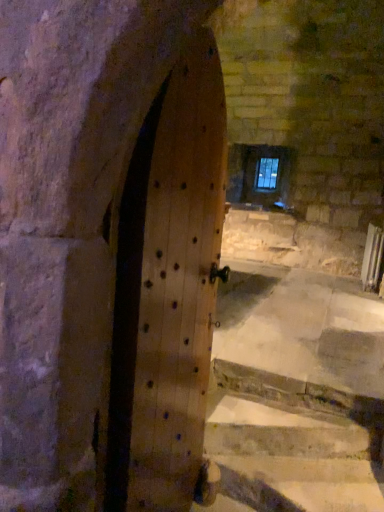
Locate an element on the screen. The height and width of the screenshot is (512, 384). clear glass window at upper center is located at coordinates (267, 173).

The height and width of the screenshot is (512, 384). Describe the element at coordinates (267, 173) in the screenshot. I see `clear glass window at upper center` at that location.

The height and width of the screenshot is (512, 384). Find the location of `natural wood door at center`. natural wood door at center is located at coordinates (167, 289).

The image size is (384, 512). What do you see at coordinates (167, 289) in the screenshot?
I see `natural wood door at center` at bounding box center [167, 289].

Locate an element on the screen. clear glass window at upper center is located at coordinates (267, 173).

Is natural wood door at center to the left of clear glass window at upper center from the viewer's perspective?

Yes, natural wood door at center is to the left of clear glass window at upper center.

In the image, is natural wood door at center positioned in front of or behind clear glass window at upper center?

natural wood door at center is positioned closer to the viewer than clear glass window at upper center.

Considering the positions of points (162, 388) and (271, 182), is point (162, 388) farther from camera compared to point (271, 182)?

That is False.

From the image's perspective, which is below, natural wood door at center or clear glass window at upper center?

natural wood door at center appears lower in the image.

From a real-world perspective, which object stands above the other?

From a 3D spatial view, clear glass window at upper center is above.

Which of these two, natural wood door at center or clear glass window at upper center, is wider?

Wider between the two is natural wood door at center.

Can you confirm if natural wood door at center is taller than clear glass window at upper center?

Yes.

Which of these two, natural wood door at center or clear glass window at upper center, is smaller?

clear glass window at upper center is smaller.

Is natural wood door at center surrounding clear glass window at upper center?

No, natural wood door at center does not contain clear glass window at upper center.

In the scene shown: Are natural wood door at center and clear glass window at upper center far apart?

Yes, natural wood door at center and clear glass window at upper center are quite far apart.

Could you tell me if natural wood door at center is facing clear glass window at upper center?

No, natural wood door at center is not facing towards clear glass window at upper center.

This screenshot has height=512, width=384. I want to click on door that is below the clear glass window at upper center (from the image's perspective), so click(x=167, y=289).

Can you confirm if clear glass window at upper center is positioned to the left of natural wood door at center?

No, clear glass window at upper center is not to the left of natural wood door at center.

Is the depth of clear glass window at upper center greater than that of natural wood door at center?

Yes, the depth of clear glass window at upper center is greater than that of natural wood door at center.

Which is farther from the camera, (278, 160) or (119, 306)?

Point (278, 160)

From the image's perspective, is clear glass window at upper center located above or below natural wood door at center?

Based on their image positions, clear glass window at upper center is located above natural wood door at center.

From a real-world perspective, which is physically below, clear glass window at upper center or natural wood door at center?

natural wood door at center, from a real-world perspective.

Is clear glass window at upper center thinner than natural wood door at center?

Correct, the width of clear glass window at upper center is less than that of natural wood door at center.

Is clear glass window at upper center taller or shorter than natural wood door at center?

In the image, clear glass window at upper center appears to be shorter than natural wood door at center.

Considering the sizes of objects clear glass window at upper center and natural wood door at center in the image provided, who is smaller, clear glass window at upper center or natural wood door at center?

Smaller between the two is clear glass window at upper center.

Does clear glass window at upper center contain natural wood door at center?

Actually, natural wood door at center is outside clear glass window at upper center.

Are clear glass window at upper center and natural wood door at center located far from each other?

Yes, clear glass window at upper center is far from natural wood door at center.

Is natural wood door at center at the back of clear glass window at upper center?

clear glass window at upper center does not have its back to natural wood door at center.

What's the angular difference between clear glass window at upper center and natural wood door at center's facing directions?

There is a 98-degree angle between the facing directions of clear glass window at upper center and natural wood door at center.

Measure the distance from clear glass window at upper center to natural wood door at center.

clear glass window at upper center is 15.38 feet from natural wood door at center.

Where is `window on the right side of natural wood door at center`? window on the right side of natural wood door at center is located at coordinates (267, 173).

Find the location of a particular element. This screenshot has width=384, height=512. window that is behind the natural wood door at center is located at coordinates (267, 173).

In the image, there is a clear glass window at upper center. Identify the location of door below it (from the image's perspective). This screenshot has height=512, width=384. (x=167, y=289).